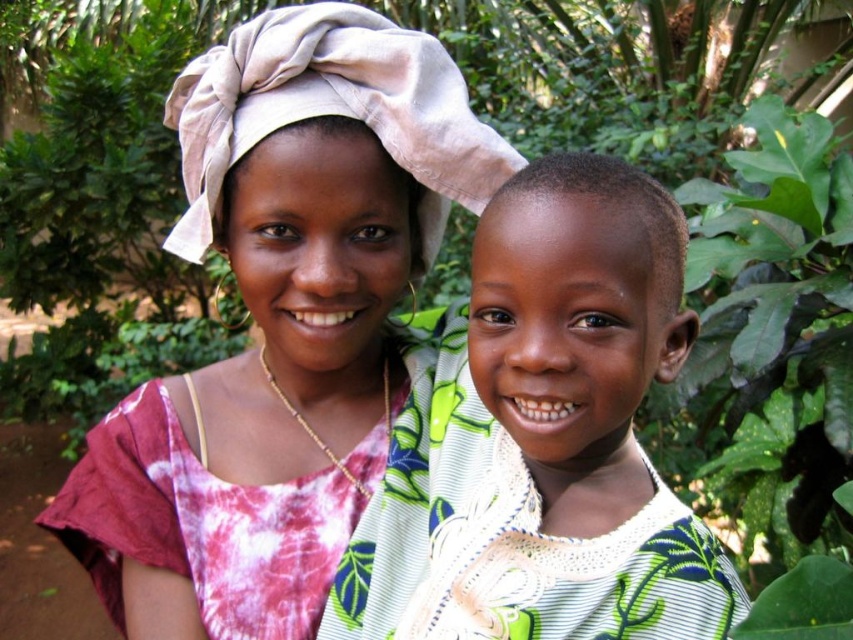
You are a photographer trying to capture a photo of the green leafy fabric at center and the smooth skin head at center. Which object should you focus on first if you want to ensure both are in sharp focus?

The green leafy fabric at center has a larger size compared to smooth skin head at center, so focusing on the green leafy fabric at center first would help ensure both are in sharp focus because it is larger and likely closer to the camera.

You are a photographer trying to capture a portrait of the two people in the scene. You want to ensure that the green leafy fabric at center and the smooth skin head at center are both visible in the frame. Based on their positions, which object should you adjust your focus to first to ensure both are in the same plane of focus?

The green leafy fabric at center is below the smooth skin head at center, so you should focus on the smooth skin head at center first to ensure both are in the same plane of focus since it is higher up and adjusting focus there would naturally include the lower object in the frame.